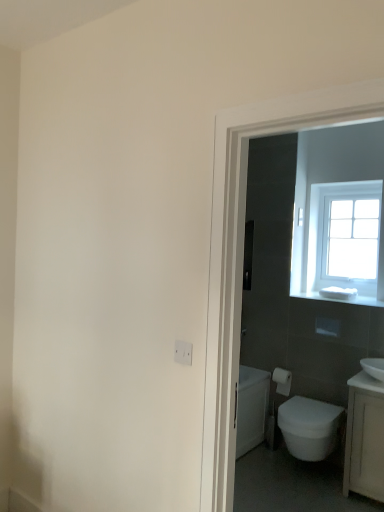
Identify the location of vacant region below white glossy bidet at lower right (from a real-world perspective). (301, 474).